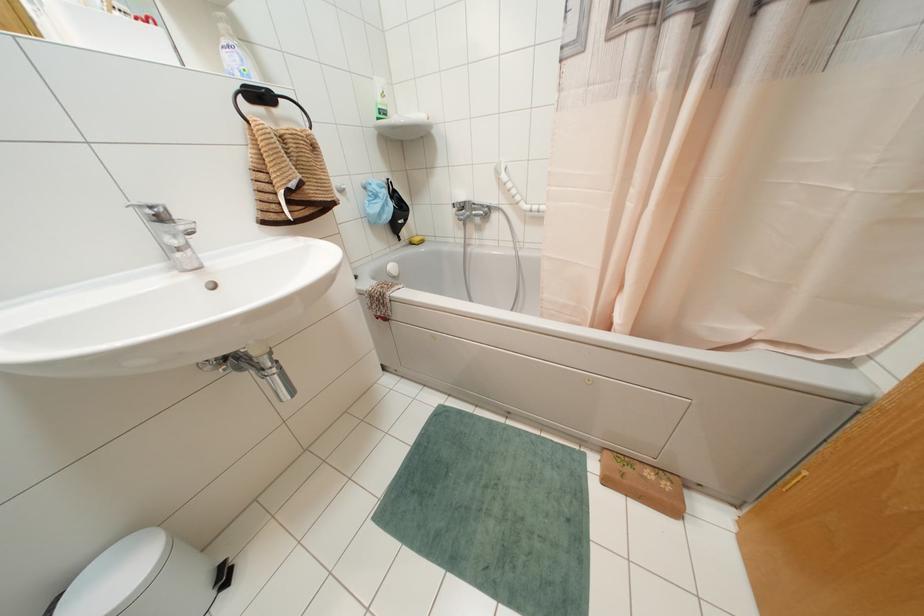
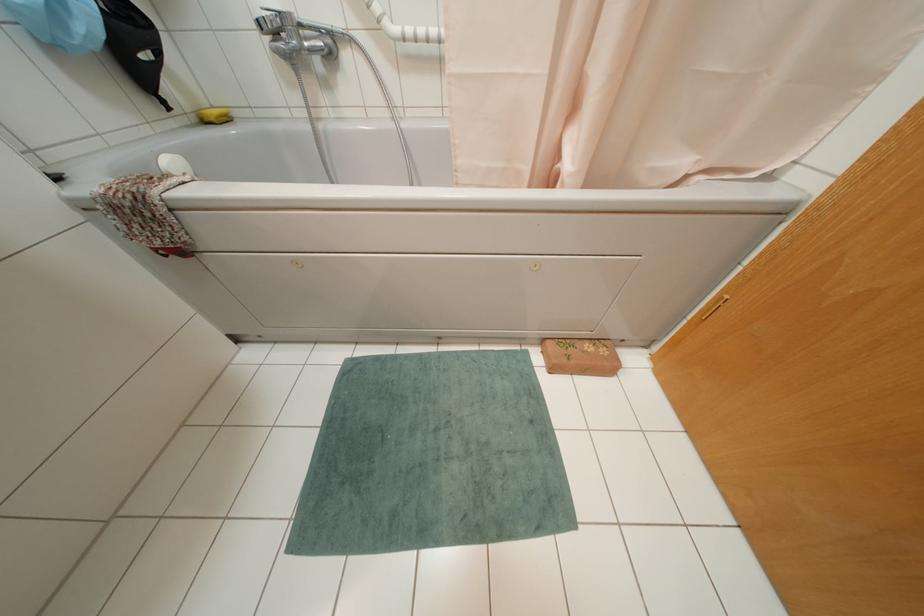
Locate, in the second image, the point that corresponds to [664,485] in the first image.

(602, 351)